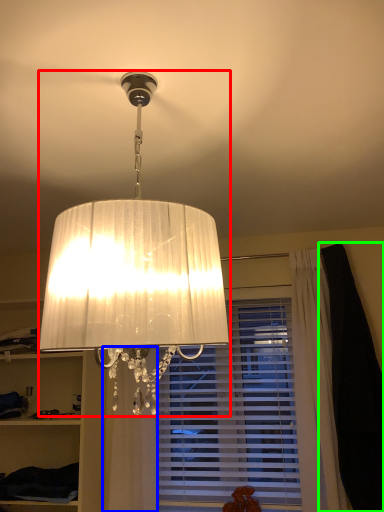
Question: Based on their relative distances, which object is nearer to lamp (highlighted by a red box)? Choose from curtain (highlighted by a blue box) and dark (highlighted by a green box).

Choices:
 (A) curtain
 (B) dark

Answer: (A)